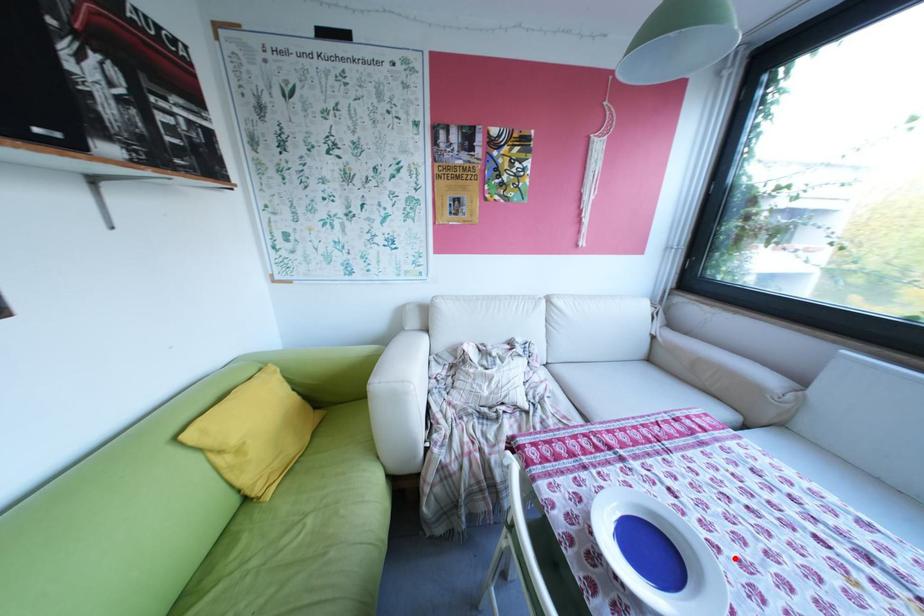
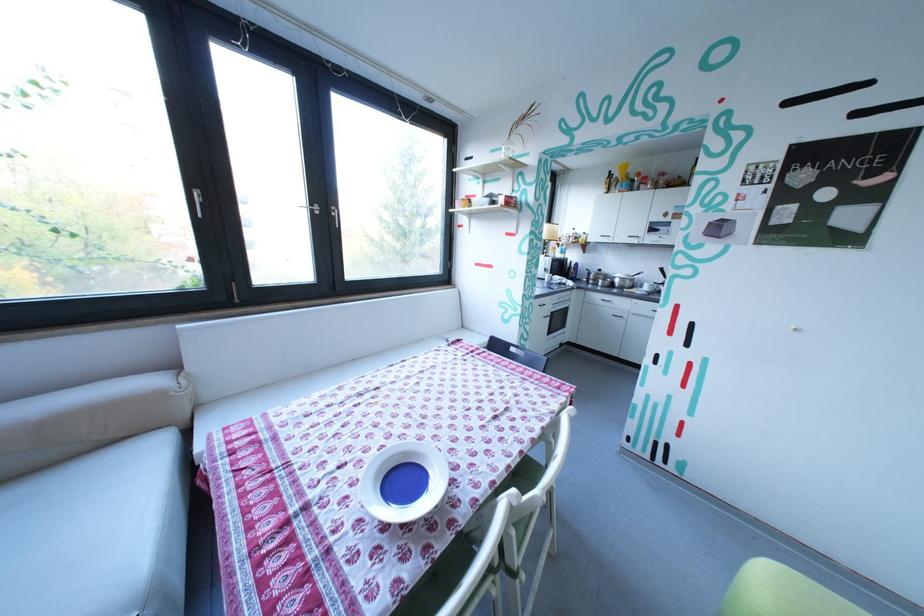
Find the pixel in the second image that matches the highlighted location in the first image.

(400, 446)